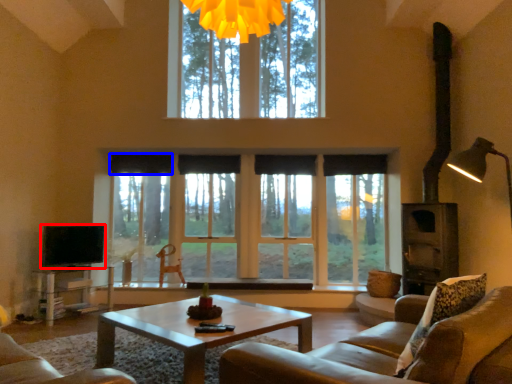
Question: Which object appears farthest to the camera in this image, level (highlighted by a red box) or curtain (highlighted by a blue box)?

Choices:
 (A) level
 (B) curtain

Answer: (B)